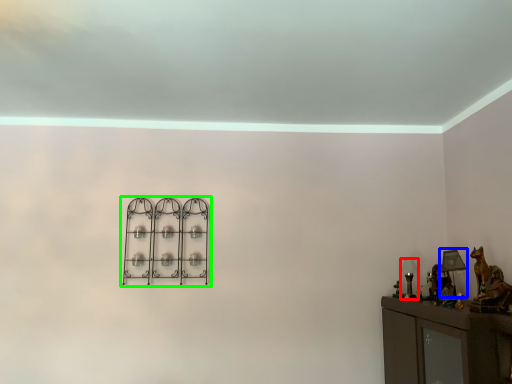
Question: Which is nearer to the table lamp (highlighted by a red box)? table lamp (highlighted by a blue box) or shelf (highlighted by a green box).

Choices:
 (A) table lamp
 (B) shelf

Answer: (A)